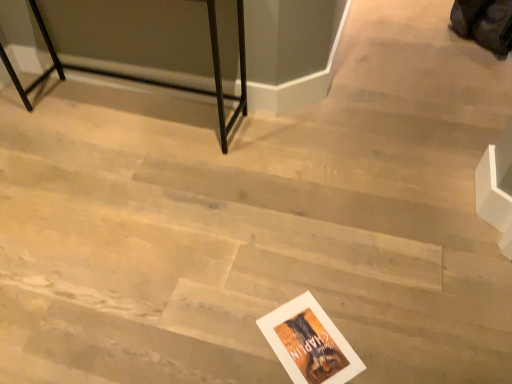
You are a GUI agent. You are given a task and a screenshot of the screen. Output one action in this format:
    pyautogui.click(x=<x>, y=<y>)
    Task: Click on the blank space to the left of white paper postcard at lower center
    The image size is (512, 384).
    Given the screenshot: What is the action you would take?
    pyautogui.click(x=240, y=337)